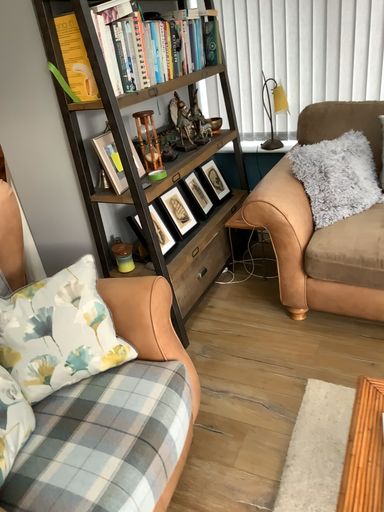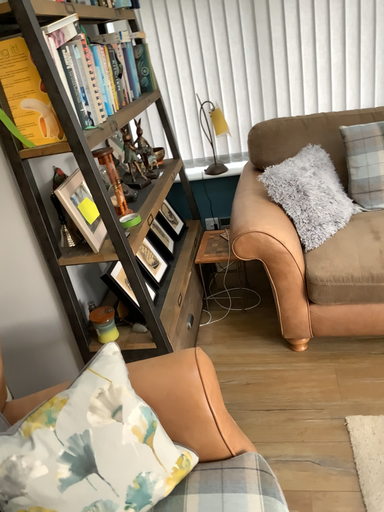
Question: Which way did the camera rotate in the video?

Choices:
 (A) rotated right
 (B) rotated left

Answer: (A)